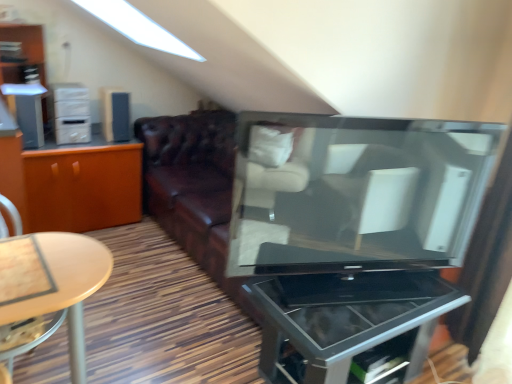
This screenshot has height=384, width=512. What are the coordinates of `free spot below matte black television at center (from a real-world perspective)` in the screenshot? It's located at (309, 287).